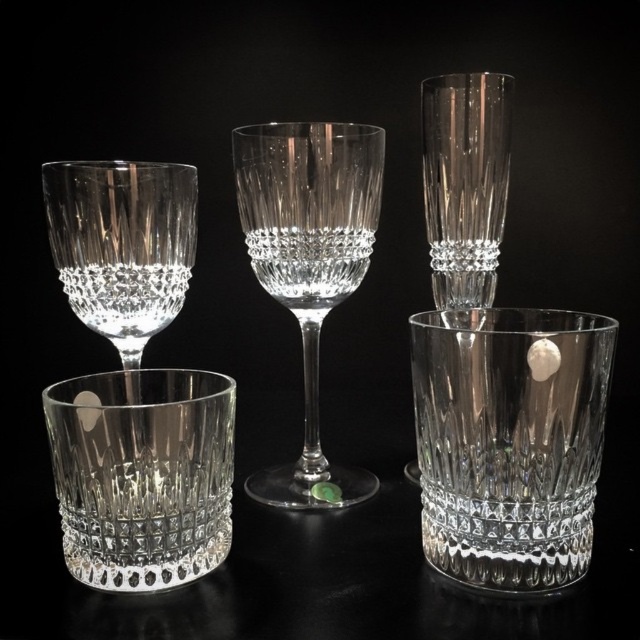
Please provide the coordinates of the clear crystal cup at center in the image.

The clear crystal cup at center is located at coordinates point (141, 474).

You are a photographer setting up a shoot for a crystal glass advertisement. You need to place a small white marble inside one of the clear crystal cups to highlight its transparency. The camera is positioned at a distance where the clear crystal cup at center appears 18.87 inches in the frame. If the marble has a diameter of 1 inch, will it fit inside the cup?

The clear crystal cup at center is 18.87 inches from the camera, but the distance does not indicate the cup size. Without knowing the cup diameter, we cannot confirm if the marble will fit. Adjust camera position or measure the cup physically.

Looking at this image, you are arranging a dinner table and need to place both the clear crystal cup at center and the crystal clear wine glass at center. Since you want to create a height contrast, which one should you place in front to ensure the taller one is visible behind?

The crystal clear wine glass at center is taller than the clear crystal cup at center, so place the shorter clear crystal cup at center in front and the taller crystal clear wine glass at center behind to create the desired height contrast.